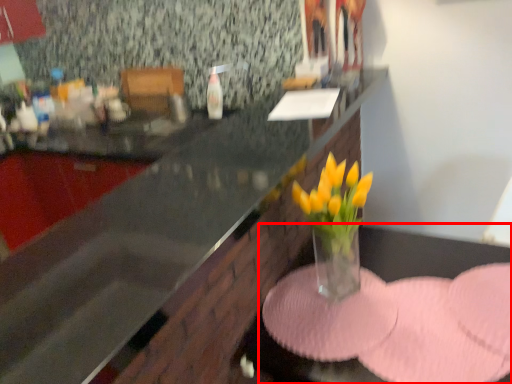
Question: From the image, what is the correct spatial relationship of table (annotated by the red box) in relation to countertop?

Choices:
 (A) left
 (B) right

Answer: (B)